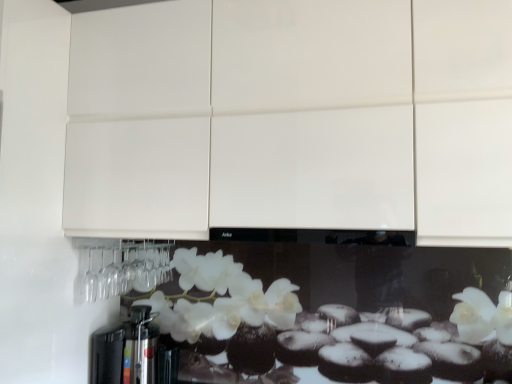
Question: Would you say metallic silver coffee machine at lower left is inside or outside white glossy cabinet at upper center?

Choices:
 (A) outside
 (B) inside

Answer: (A)

Question: Considering the positions of metallic silver coffee machine at lower left and white glossy cabinet at upper center in the image, is metallic silver coffee machine at lower left taller or shorter than white glossy cabinet at upper center?

Choices:
 (A) tall
 (B) short

Answer: (B)

Question: Is metallic silver coffee machine at lower left wider or thinner than white glossy cabinet at upper center?

Choices:
 (A) thin
 (B) wide

Answer: (A)

Question: Is white glossy cabinet at upper center taller or shorter than metallic silver coffee machine at lower left?

Choices:
 (A) tall
 (B) short

Answer: (A)

Question: Is white glossy cabinet at upper center to the left or to the right of metallic silver coffee machine at lower left in the image?

Choices:
 (A) right
 (B) left

Answer: (A)

Question: Considering the positions of point (140, 72) and point (140, 332), is point (140, 72) closer or farther from the camera than point (140, 332)?

Choices:
 (A) farther
 (B) closer

Answer: (B)

Question: From the image's perspective, is white glossy cabinet at upper center located above or below metallic silver coffee machine at lower left?

Choices:
 (A) above
 (B) below

Answer: (A)